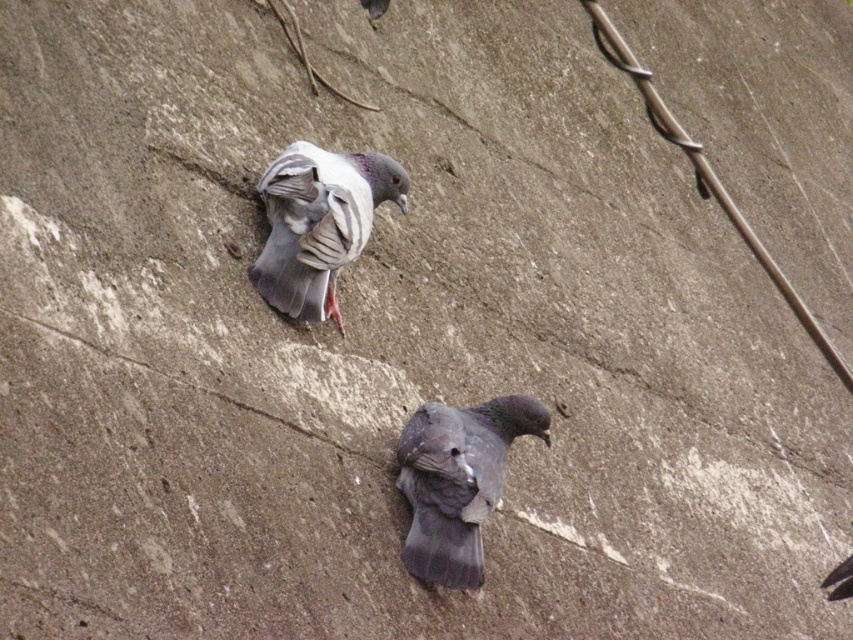
Based on the photo, you are standing at the camera position and want to throw a small pebble to the gray matte pigeon at center. If the maximum distance you can throw is 15 meters, will you be able to reach the pigeon?

The gray matte pigeon at center and camera are 15.33 meters apart from each other. Since your maximum throwing distance is 15 meters, you cannot reach the pigeon as the distance is slightly beyond your range.

You are a photographer trying to capture both pigeons in a single shot. Given their sizes in the image, which pigeon, the gray matte pigeon at center or the gray matte pigeon at upper center, would you need to zoom in more to include fully in the frame?

The gray matte pigeon at upper center requires more zoom because it occupies more space in the image than the gray matte pigeon at center, so to fit it fully in the frame, you need to zoom in more compared to the smaller pigeon at center.

You are a birdwatcher observing two pigeons on a concrete surface. You notice the gray matte pigeon at center and the gray matte pigeon at upper center. Which pigeon is positioned lower in height compared to the other?

The gray matte pigeon at center has a lesser height compared to the gray matte pigeon at upper center, so it is positioned lower.